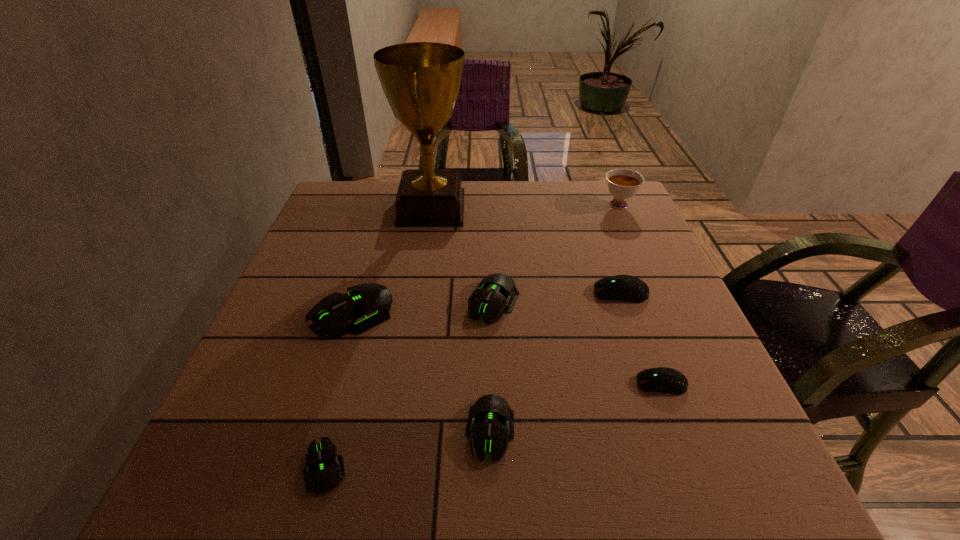
At what (x,y) coordinates should I click in order to perform the action: click on vacant area located 0.270m on the front of the second biggest gray computer mouse. Please return your answer as a coordinate pair (x, y). Looking at the image, I should click on [499, 455].

Where is `free location located 0.250m on the button of the third nearest object`? The height and width of the screenshot is (540, 960). free location located 0.250m on the button of the third nearest object is located at coordinates (498, 384).

Locate an element on the screen. free space located on the button of the third nearest object is located at coordinates (498, 384).

This screenshot has width=960, height=540. I want to click on free region located on the button of the third nearest object, so coord(559,384).

Image resolution: width=960 pixels, height=540 pixels. In order to click on free space located 0.400m on the left of the second smallest gray computer mouse in this screenshot , I will do `click(222, 431)`.

Find the location of a particular element. vacant space located 0.170m on the left of the shortest object is located at coordinates (194, 467).

Identify the location of award positioned at the far edge. The image size is (960, 540). (421, 80).

This screenshot has width=960, height=540. What are the coordinates of `teacup that is at the far edge` in the screenshot? It's located at (622, 184).

Find the location of `object that is at the left edge`. object that is at the left edge is located at coordinates point(367,305).

The width and height of the screenshot is (960, 540). What are the coordinates of `teacup located at the right edge` in the screenshot? It's located at (622, 184).